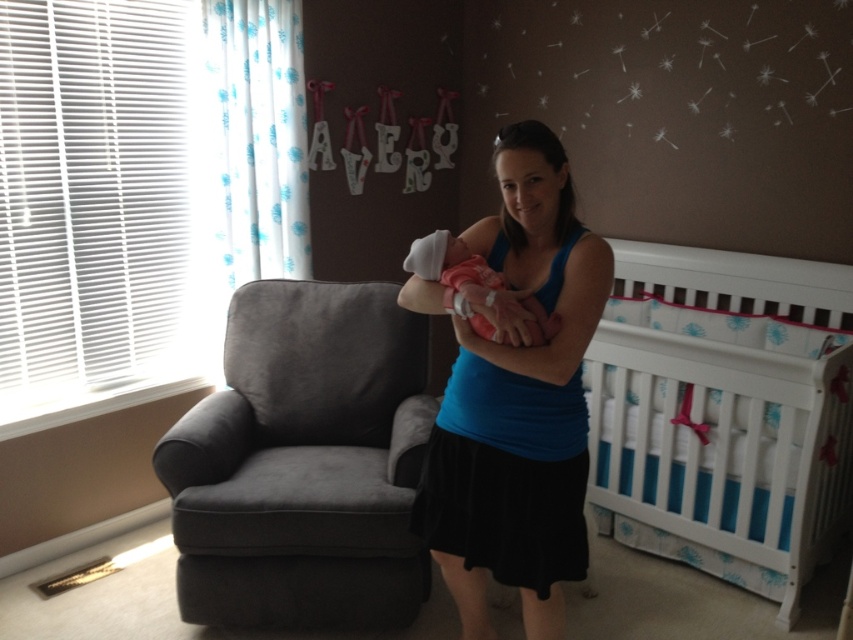
Who is more distant from viewer, (270, 456) or (480, 364)?

The point (270, 456) is behind.

You are a GUI agent. You are given a task and a screenshot of the screen. Output one action in this format:
    pyautogui.click(x=<x>, y=<y>)
    Task: Click on the dark gray suede armchair at left
    This screenshot has height=640, width=853.
    Given the screenshot: What is the action you would take?
    pyautogui.click(x=300, y=465)

Between point (770, 285) and point (467, 484), which one is positioned in front?

Point (467, 484) is in front.

Is white wooden crib at right above blue fabric tank top at center?

Incorrect, white wooden crib at right is not positioned above blue fabric tank top at center.

Find the location of a particular element. white wooden crib at right is located at coordinates (724, 406).

You are a GUI agent. You are given a task and a screenshot of the screen. Output one action in this format:
    pyautogui.click(x=<x>, y=<y>)
    Task: Click on the white wooden crib at right
    This screenshot has width=853, height=640.
    Given the screenshot: What is the action you would take?
    pyautogui.click(x=724, y=406)

You are a GUI agent. You are given a task and a screenshot of the screen. Output one action in this format:
    pyautogui.click(x=<x>, y=<y>)
    Task: Click on the white wooden crib at right
    This screenshot has width=853, height=640.
    Given the screenshot: What is the action you would take?
    pyautogui.click(x=724, y=406)

Which is more to the right, white wooden crib at right or pink fabric newborn at center?

white wooden crib at right

Where is `white wooden crib at right`? white wooden crib at right is located at coordinates (724, 406).